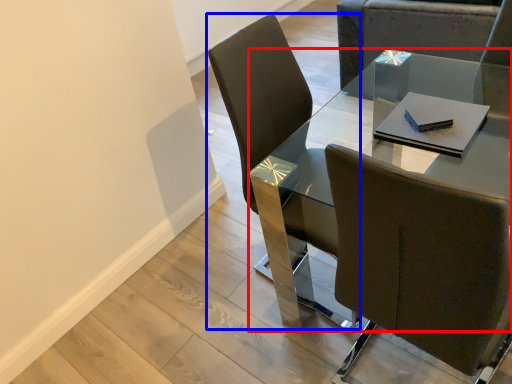
Question: Which object appears farthest to the camera in this image, table (highlighted by a red box) or chair (highlighted by a blue box)?

Choices:
 (A) table
 (B) chair

Answer: (B)